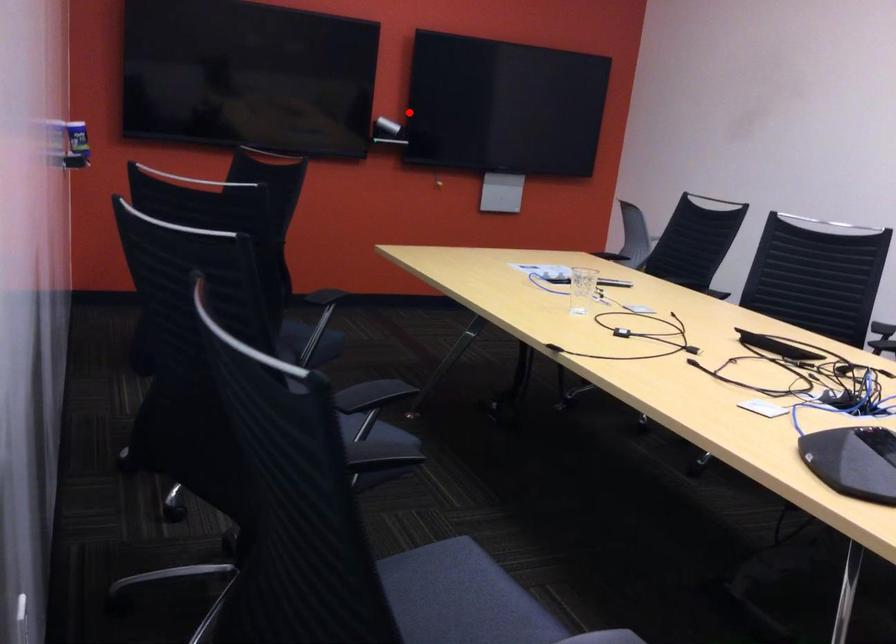
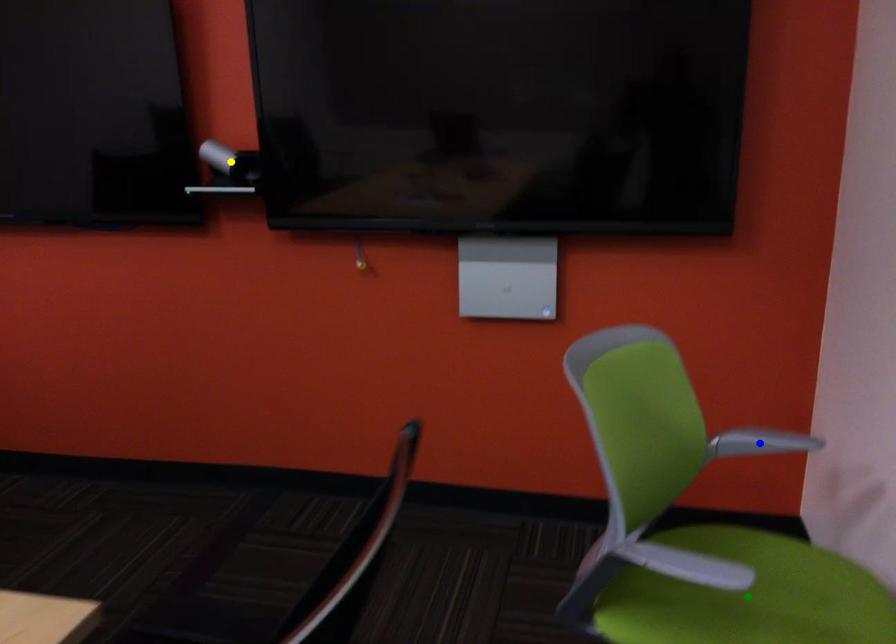
Question: I am providing you with two images of the same scene from different viewpoints. A red point is marked on the first image. You are given multiple points on the second image. Which point in image 2 is actually the same real-world point as the red point in image 1?

Choices:
 (A) green point
 (B) blue point
 (C) yellow point

Answer: (C)